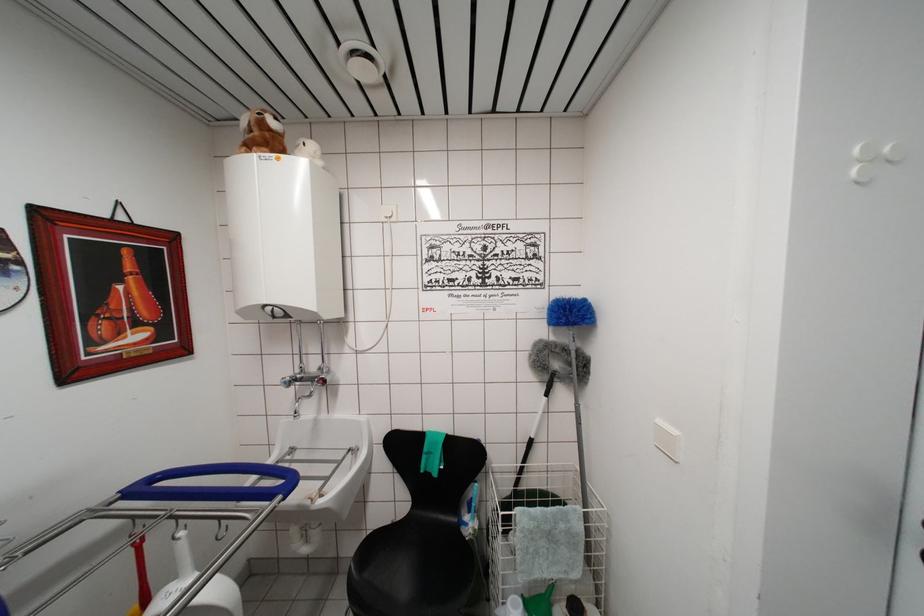
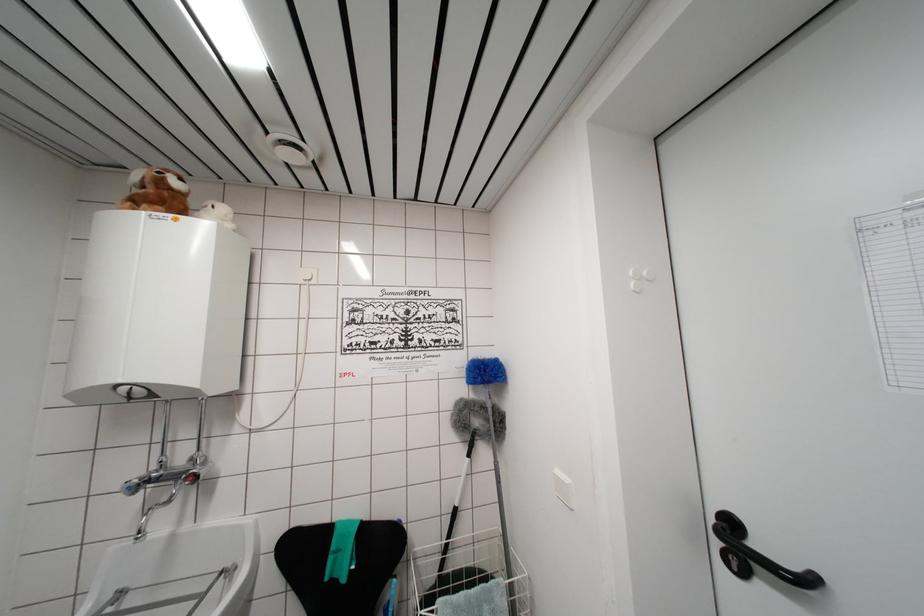
Locate, in the second image, the point that corresponds to point 273,151 in the first image.

(168, 209)